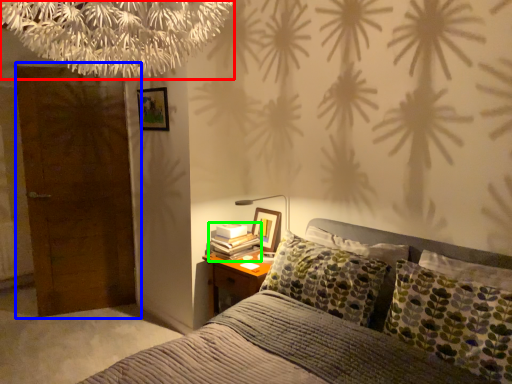
Question: Which object is the closest to the tree (highlighted by a red box)? Choose among these: door (highlighted by a blue box) or book (highlighted by a green box).

Choices:
 (A) door
 (B) book

Answer: (B)